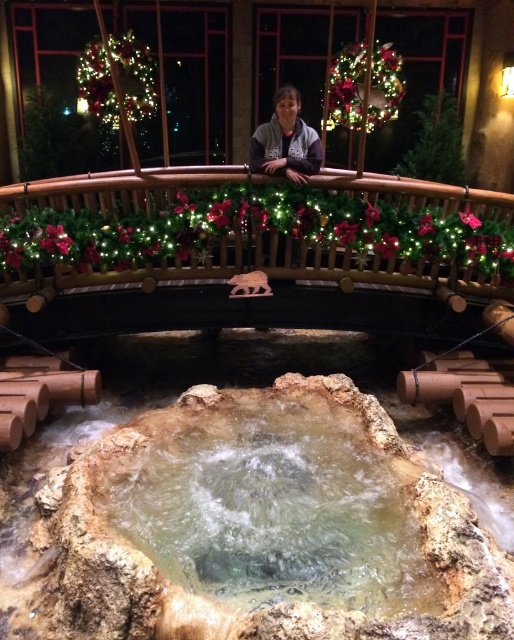
In the scene shown: You are standing at the base of the fountain and want to place a small decorative item on the surface. Given that the translucent rock water at center is not as tall as the gray fleece jacket at upper center, can you estimate if the item will fit on the water surface without being submerged?

The translucent rock water at center is shorter than the gray fleece jacket at upper center, so the water surface is lower. The item may not be submerged if placed carefully on the surface, but the water level might not submerge it unless it floats. However, the height comparison here is between the water and the jacket, so the jacket is taller. The water surface itself is at its own level, so the item can be placed on the water surface as long as it floats or is placed gently.